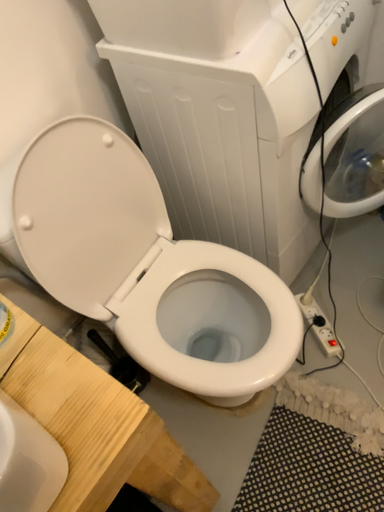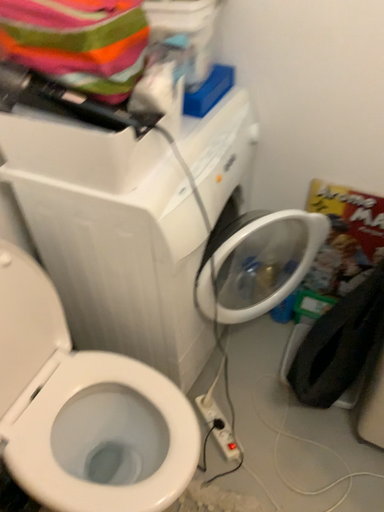
Question: Which way did the camera rotate in the video?

Choices:
 (A) rotated downward
 (B) rotated upward

Answer: (B)